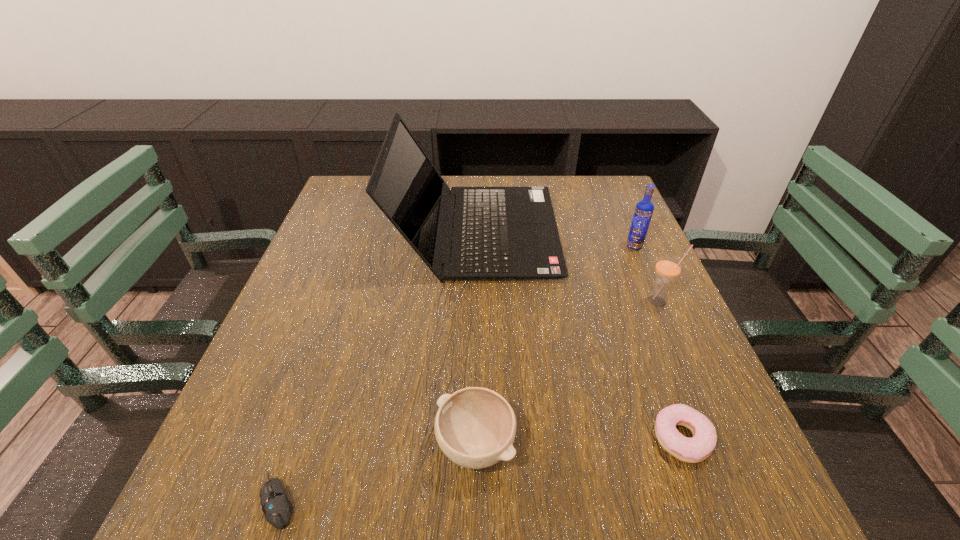
Find the location of `vacant space situated 0.130m on the right of the bowl`. vacant space situated 0.130m on the right of the bowl is located at coordinates (595, 445).

Where is `free space located 0.170m on the back of the second shortest object`? The width and height of the screenshot is (960, 540). free space located 0.170m on the back of the second shortest object is located at coordinates (644, 336).

Where is `vacant region located 0.330m on the back of the shortest object`? vacant region located 0.330m on the back of the shortest object is located at coordinates (339, 318).

Identify the location of object located in the far edge section of the desktop. This screenshot has width=960, height=540. (499, 232).

The height and width of the screenshot is (540, 960). What are the coordinates of `bowl that is at the near edge` in the screenshot? It's located at (475, 427).

You are a GUI agent. You are given a task and a screenshot of the screen. Output one action in this format:
    pyautogui.click(x=<x>, y=<y>)
    Task: Click on the computer mouse located at the near edge
    The height and width of the screenshot is (540, 960).
    Given the screenshot: What is the action you would take?
    pyautogui.click(x=277, y=508)

Locate an element on the screen. This screenshot has width=960, height=540. object located at the left edge is located at coordinates (277, 508).

I want to click on vodka situated at the right edge, so click(x=644, y=209).

Locate an element on the screen. This screenshot has height=540, width=960. straw that is at the right edge is located at coordinates (668, 267).

The width and height of the screenshot is (960, 540). I want to click on doughnut that is at the right edge, so click(x=698, y=448).